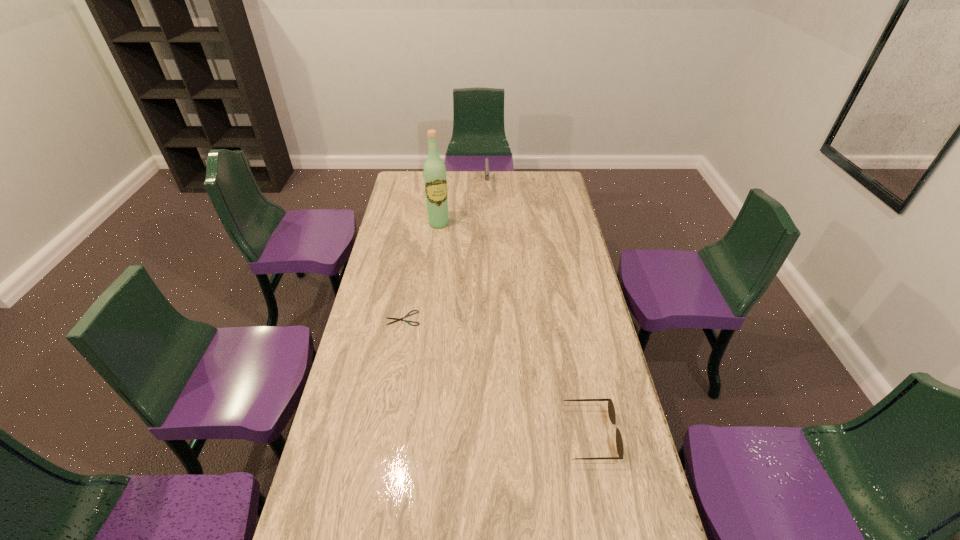
Identify the location of vacant space that is in between the shortest object and the sunglasses. (496, 376).

The width and height of the screenshot is (960, 540). I want to click on empty space that is in between the second tallest object and the shears, so click(445, 252).

What are the coordinates of `empty space between the sunglasses and the third nearest object` in the screenshot? It's located at (515, 329).

In order to click on vacant area that lies between the tallest object and the second tallest object in this screenshot , I will do `click(463, 204)`.

Find the location of `the third closest object to the shortest object`. the third closest object to the shortest object is located at coordinates click(x=486, y=160).

Where is `object that is the third closest one to the shears`? object that is the third closest one to the shears is located at coordinates (486, 160).

The height and width of the screenshot is (540, 960). Find the location of `vacant area that satisfies the following two spatial constraints: 1. on the back side of the wine bottle; 2. on the right side of the second tallest object`. vacant area that satisfies the following two spatial constraints: 1. on the back side of the wine bottle; 2. on the right side of the second tallest object is located at coordinates (444, 185).

Locate an element on the screen. The height and width of the screenshot is (540, 960). free location that satisfies the following two spatial constraints: 1. on the back side of the farthest object; 2. on the right side of the wine bottle is located at coordinates (444, 185).

The height and width of the screenshot is (540, 960). Identify the location of vacant space that satisfies the following two spatial constraints: 1. on the front side of the rightmost object; 2. on the front-facing side of the tallest object. (414, 434).

In order to click on free space that satisfies the following two spatial constraints: 1. on the front side of the third object from left to right; 2. on the front-facing side of the rightmost object in this screenshot , I will do `click(492, 434)`.